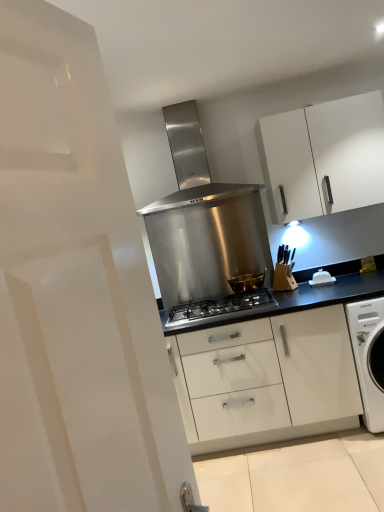
Question: Considering the relative sizes of white plastic butter dish at center-right and white matte cabinet at upper right in the image provided, is white plastic butter dish at center-right shorter than white matte cabinet at upper right?

Choices:
 (A) no
 (B) yes

Answer: (B)

Question: Could you tell me if white plastic butter dish at center-right is facing white matte cabinet at upper right?

Choices:
 (A) no
 (B) yes

Answer: (A)

Question: Is white plastic butter dish at center-right next to white matte cabinet at upper right?

Choices:
 (A) no
 (B) yes

Answer: (A)

Question: From the image's perspective, is white plastic butter dish at center-right located beneath white matte cabinet at upper right?

Choices:
 (A) no
 (B) yes

Answer: (B)

Question: Is white plastic butter dish at center-right not near white matte cabinet at upper right?

Choices:
 (A) no
 (B) yes

Answer: (A)

Question: Does white plastic butter dish at center-right have a smaller size compared to white matte cabinet at upper right?

Choices:
 (A) no
 (B) yes

Answer: (B)

Question: Would you say gold metallic bowl at center is a long distance from white matte cabinet at upper right?

Choices:
 (A) no
 (B) yes

Answer: (A)

Question: Is gold metallic bowl at center oriented towards white matte cabinet at upper right?

Choices:
 (A) yes
 (B) no

Answer: (B)

Question: From a real-world perspective, does gold metallic bowl at center sit lower than white matte cabinet at upper right?

Choices:
 (A) yes
 (B) no

Answer: (A)

Question: Is gold metallic bowl at center not inside white matte cabinet at upper right?

Choices:
 (A) yes
 (B) no

Answer: (A)

Question: Can you confirm if gold metallic bowl at center is thinner than white matte cabinet at upper right?

Choices:
 (A) no
 (B) yes

Answer: (B)

Question: Can you confirm if gold metallic bowl at center is wider than white matte cabinet at upper right?

Choices:
 (A) yes
 (B) no

Answer: (B)

Question: Is white matte cabinet at upper right not near white plastic butter dish at center-right?

Choices:
 (A) no
 (B) yes

Answer: (A)